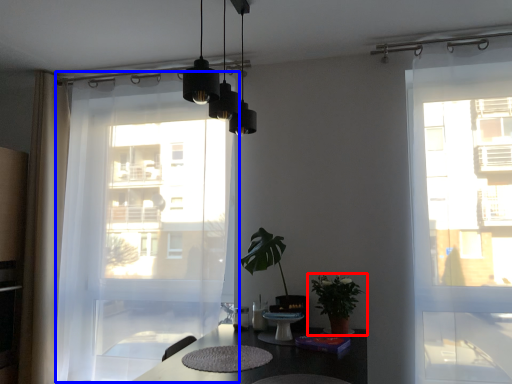
Question: Which object is further to the camera taking this photo, houseplant (highlighted by a red box) or curtain (highlighted by a blue box)?

Choices:
 (A) houseplant
 (B) curtain

Answer: (B)